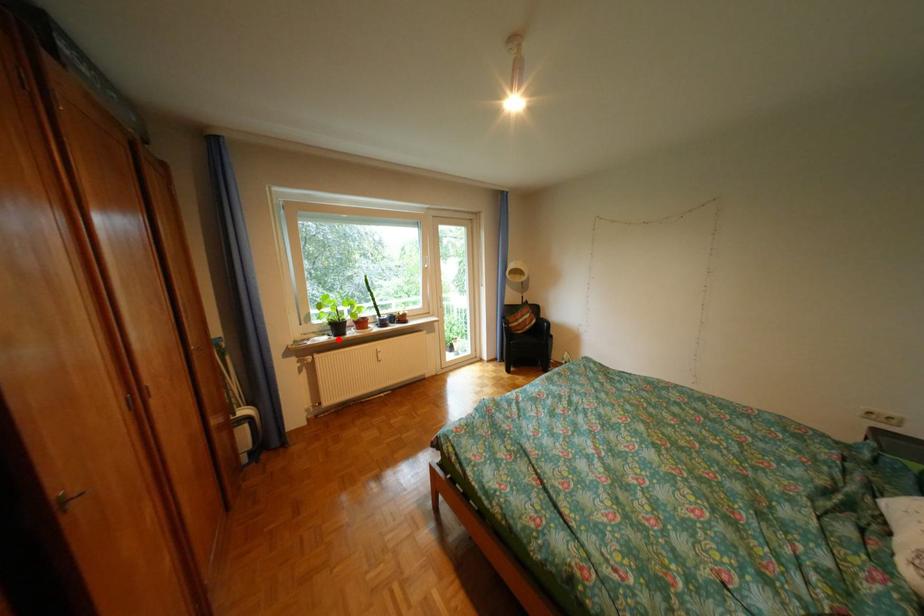
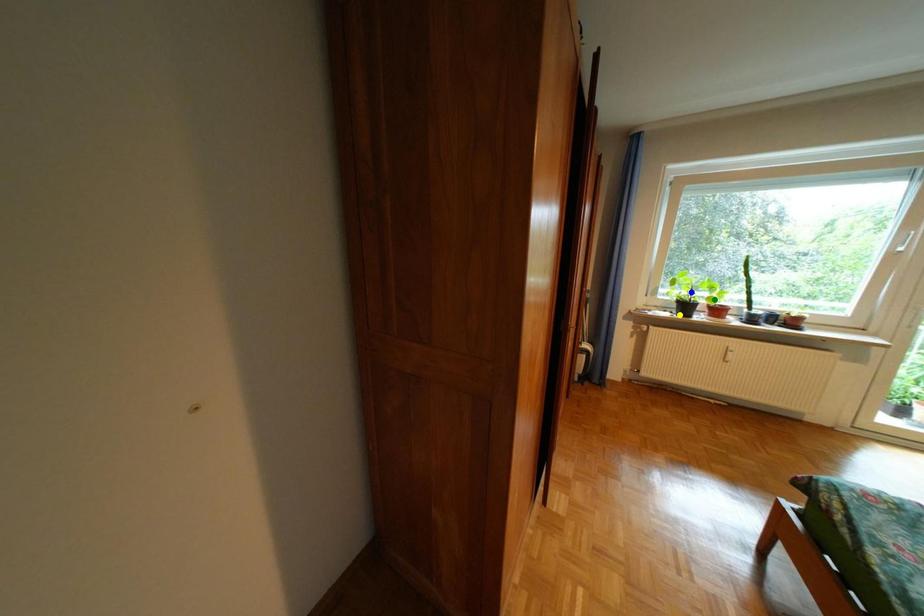
Question: I am providing you with two images of the same scene from different viewpoints. A red point is marked on the first image. You are given multiple points on the second image. Which mark in image 2 goes with the point in image 1?

Choices:
 (A) yellow point
 (B) green point
 (C) blue point

Answer: (A)